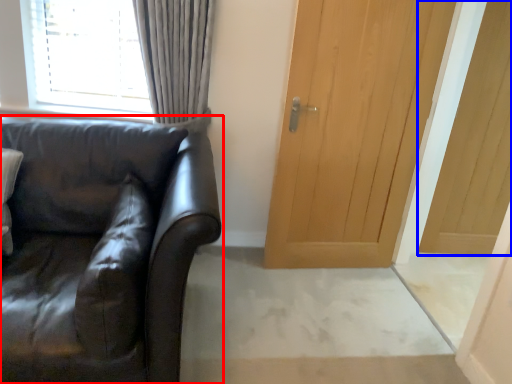
Question: Which point is further to the camera, studio couch (highlighted by a red box) or door (highlighted by a blue box)?

Choices:
 (A) studio couch
 (B) door

Answer: (B)